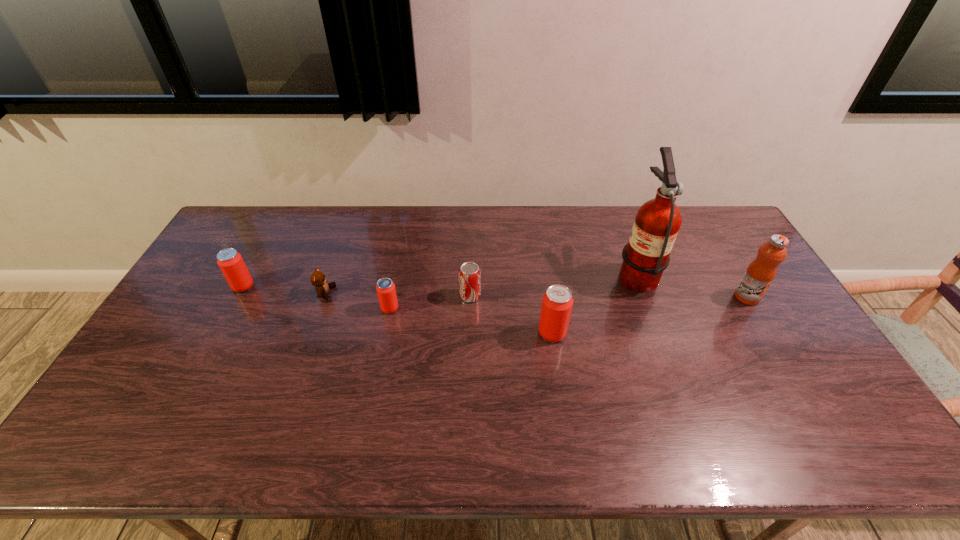
Image resolution: width=960 pixels, height=540 pixels. Find the location of `soda can`. soda can is located at coordinates (469, 273).

Identify the location of teddy bear. (317, 279).

You are a GUI agent. You are given a task and a screenshot of the screen. Output one action in this format:
    pyautogui.click(x=<x>, y=<y>)
    Task: Click on the second object from left to right
    This screenshot has height=540, width=960.
    Given the screenshot: What is the action you would take?
    pyautogui.click(x=317, y=279)

At what (x,y) coordinates should I click in order to perform the action: click on vacant space located on the front of the leftmost beer can. Please return your answer as a coordinate pair (x, y). This screenshot has height=540, width=960. Looking at the image, I should click on (230, 311).

Locate an element on the screen. The height and width of the screenshot is (540, 960). vacant area situated 0.280m on the back of the third object from left to right is located at coordinates (402, 244).

Identify the location of vacant space situated 0.050m on the front of the third object from right to left. The width and height of the screenshot is (960, 540). (556, 359).

What are the coordinates of `free location located on the nozzle and handle of the sixth object from left to right` in the screenshot? It's located at (499, 273).

Locate an element on the screen. This screenshot has width=960, height=540. free space located on the nozzle and handle of the sixth object from left to right is located at coordinates tap(560, 273).

I want to click on free space located 0.350m on the nozzle and handle of the sixth object from left to right, so click(x=509, y=273).

What are the coordinates of `free space located on the front label of the fruit juice` in the screenshot? It's located at (809, 402).